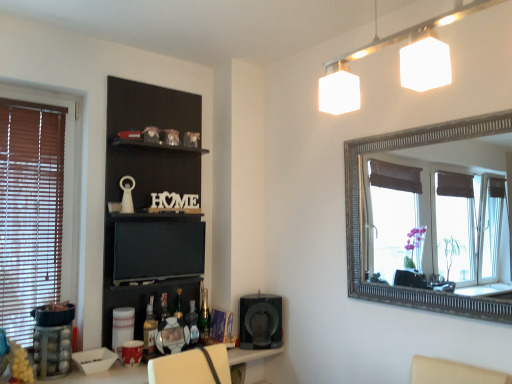
Question: Is metallic silver picture frame at center wider or thinner than translucent glass bottle at lower center, acting as the 3th bottle starting from the back?

Choices:
 (A) wide
 (B) thin

Answer: (A)

Question: Visually, is metallic silver picture frame at center positioned to the left or to the right of translucent glass bottle at lower center, acting as the 3th bottle starting from the back?

Choices:
 (A) right
 (B) left

Answer: (A)

Question: Based on their relative distances, which object is nearer to the green glass bottle at lower center, which is the 1th bottle from back to front?

Choices:
 (A) translucent glass bottle at lower center, acting as the 3th bottle starting from the back
 (B) black matte speaker at lower center
 (C) matte black tv at center
 (D) translucent plastic bottle at lower center, the second bottle viewed from the left
 (E) white glossy table at lower center

Answer: (D)

Question: Considering the real-world distances, which object is closest to the metallic silver picture frame at center?

Choices:
 (A) matte black tv at center
 (B) black matte speaker at lower center
 (C) black matte shelf at upper center
 (D) green glass bottle at lower center, which is the 1th bottle from back to front
 (E) translucent glass bottle at lower center, acting as the 3th bottle starting from the back

Answer: (E)